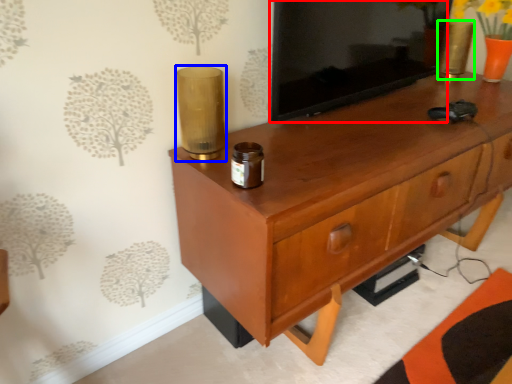
Question: Which object is the farthest from tv cabinet (highlighted by a red box)? Choose among these: candle holder (highlighted by a blue box) or candle holder (highlighted by a green box).

Choices:
 (A) candle holder
 (B) candle holder

Answer: (B)